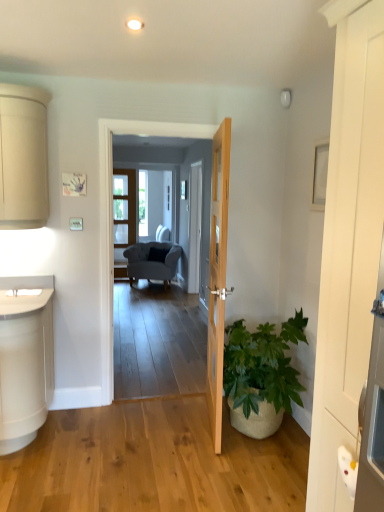
You are a GUI agent. You are given a task and a screenshot of the screen. Output one action in this format:
    pyautogui.click(x=<x>, y=<y>)
    Task: Click on the free space in front of green leafy plant in woven basket at lower right
    
    Given the screenshot: What is the action you would take?
    pyautogui.click(x=241, y=479)